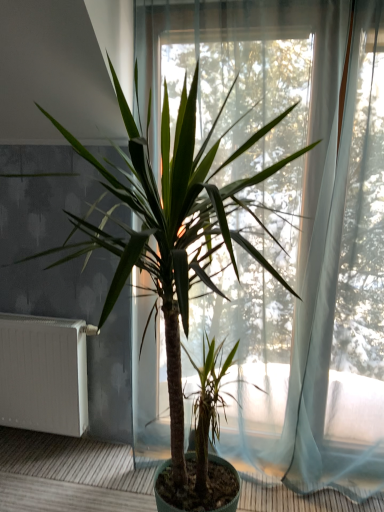
Where is `white matte radiator at left`? The image size is (384, 512). white matte radiator at left is located at coordinates (44, 374).

The image size is (384, 512). What do you see at coordinates (44, 374) in the screenshot?
I see `white matte radiator at left` at bounding box center [44, 374].

Describe the element at coordinates (290, 227) in the screenshot. I see `transparent curtain at center` at that location.

You are a GUI agent. You are given a task and a screenshot of the screen. Output one action in this format:
    pyautogui.click(x=<x>, y=<y>)
    Task: Click on the transparent curtain at center
    Image resolution: width=384 pixels, height=512 pixels.
    Given the screenshot: What is the action you would take?
    pyautogui.click(x=290, y=227)

Identify the location of white matte radiator at left. The image size is (384, 512). (44, 374).

Which object is positioned more to the right, transparent curtain at center or white matte radiator at left?

From the viewer's perspective, transparent curtain at center appears more on the right side.

Does transparent curtain at center come behind white matte radiator at left?

No, transparent curtain at center is closer to the camera.

Considering the positions of points (289, 169) and (12, 391), is point (289, 169) closer to camera compared to point (12, 391)?

Yes, point (289, 169) is in front of point (12, 391).

From the image's perspective, which one is positioned lower, transparent curtain at center or white matte radiator at left?

white matte radiator at left is shown below in the image.

From a real-world perspective, is transparent curtain at center above or below white matte radiator at left?

In terms of real-world spatial position, transparent curtain at center is above white matte radiator at left.

Is transparent curtain at center thinner than white matte radiator at left?

In fact, transparent curtain at center might be wider than white matte radiator at left.

Does transparent curtain at center have a greater height compared to white matte radiator at left?

Indeed, transparent curtain at center has a greater height compared to white matte radiator at left.

Between transparent curtain at center and white matte radiator at left, which one has smaller size?

white matte radiator at left is smaller.

Is transparent curtain at center positioned beyond the bounds of white matte radiator at left?

Absolutely, transparent curtain at center is external to white matte radiator at left.

Would you say transparent curtain at center is a long distance from white matte radiator at left?

No, transparent curtain at center is in close proximity to white matte radiator at left.

Is transparent curtain at center oriented towards white matte radiator at left?

No, transparent curtain at center is not turned towards white matte radiator at left.

The height and width of the screenshot is (512, 384). I want to click on radiator directly beneath the transparent curtain at center (from a real-world perspective), so click(44, 374).

Can you confirm if white matte radiator at left is positioned to the left of transparent curtain at center?

Yes.

Does white matte radiator at left come in front of transparent curtain at center?

That is False.

Which is closer, (x=5, y=399) or (x=328, y=394)?

Point (x=5, y=399) is farther from the camera than point (x=328, y=394).

From the image's perspective, is white matte radiator at left above or below transparent curtain at center?

white matte radiator at left is below transparent curtain at center.

In the scene shown: From a real-world perspective, is white matte radiator at left above or below transparent curtain at center?

white matte radiator at left is situated lower than transparent curtain at center in the real world.

Considering the sizes of white matte radiator at left and transparent curtain at center in the image, is white matte radiator at left wider or thinner than transparent curtain at center?

In the image, white matte radiator at left appears to be more narrow than transparent curtain at center.

Can you confirm if white matte radiator at left is shorter than transparent curtain at center?

Yes, white matte radiator at left is shorter than transparent curtain at center.

Is white matte radiator at left bigger or smaller than transparent curtain at center?

Clearly, white matte radiator at left is smaller in size than transparent curtain at center.

Can we say white matte radiator at left lies outside transparent curtain at center?

Yes.

Is white matte radiator at left beside transparent curtain at center?

white matte radiator at left and transparent curtain at center are not in contact.

Consider the image. Is transparent curtain at center at the back of white matte radiator at left?

white matte radiator at left is not turned away from transparent curtain at center.

How many degrees apart are the facing directions of white matte radiator at left and transparent curtain at center?

4.98 degrees.

Locate an element on the screen. window located above the white matte radiator at left (from the image's perspective) is located at coordinates (290, 227).

Find the location of a particular element. The height and width of the screenshot is (512, 384). radiator behind the transparent curtain at center is located at coordinates (44, 374).

This screenshot has width=384, height=512. I want to click on radiator below the transparent curtain at center (from the image's perspective), so click(44, 374).